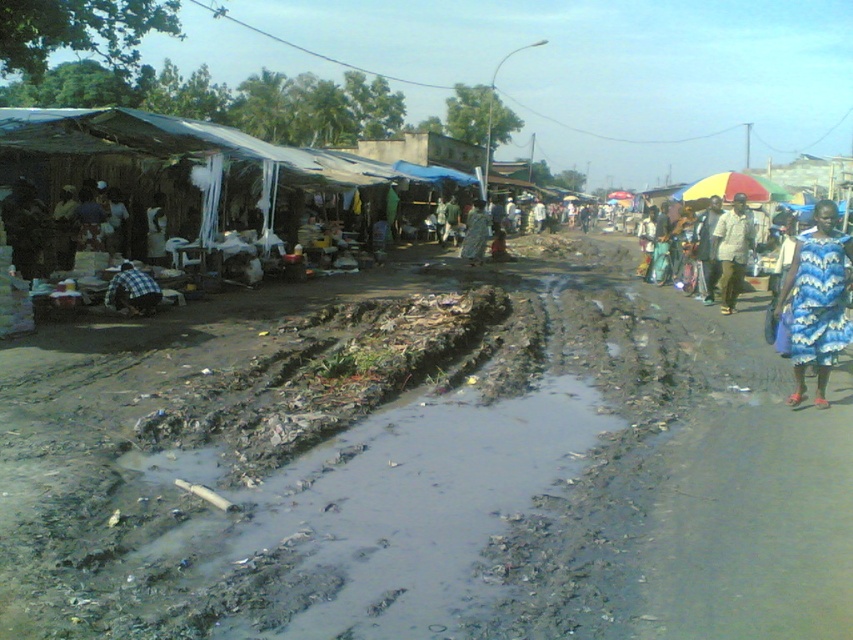
Consider the image. You are a photographer standing at the camera position. You want to capture a clear photo of the blue printed dress at lower right without any foreground obstructions. The dress is 23.66 feet away from you. Considering the muddy road with puddles and debris between you and the dress, can you walk straight to it to get a closer shot?

The blue printed dress at lower right is 23.66 feet away from the camera. However, the muddy road with puddles and debris between you and the dress might obstruct your path. You should check for a clear path or alternative route to avoid obstacles while approaching the dress for the photo.

You are a customer at the market and want to buy both the blue printed dress at lower right and the multicolored fabric umbrella at right. If you have a bag that can only hold one item, which item should you choose to carry first based on their sizes?

The blue printed dress at lower right has a smaller width than the multicolored fabric umbrella at right. Therefore, you should carry the multicolored fabric umbrella at right first since it is larger and might require more space in your bag.